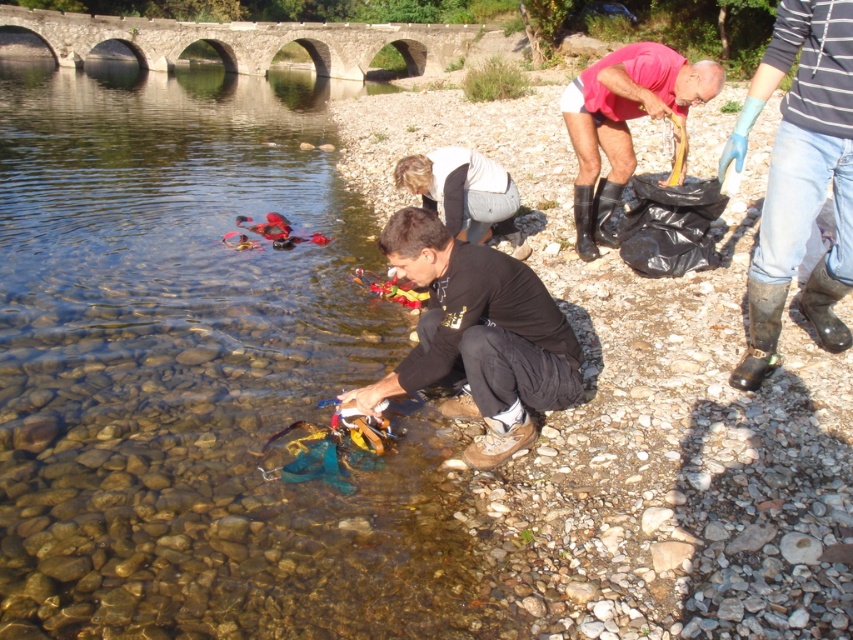
Question: Which object is farther from the camera taking this photo?

Choices:
 (A) rubber boots at right
 (B) black matte clothing at center

Answer: (A)

Question: Can you confirm if black matte clothing at center is smaller than white matte shirt at center?

Choices:
 (A) yes
 (B) no

Answer: (B)

Question: Among these objects, which one is farthest from the camera?

Choices:
 (A) rubber boots at right
 (B) clear stone creek at center

Answer: (A)

Question: Can you confirm if clear stone creek at center is positioned above black matte clothing at center?

Choices:
 (A) yes
 (B) no

Answer: (A)

Question: Can you confirm if rubber boots at right is wider than white matte shirt at center?

Choices:
 (A) no
 (B) yes

Answer: (B)

Question: Which object appears farthest from the camera in this image?

Choices:
 (A) white matte shirt at center
 (B) rubber boots at right

Answer: (B)